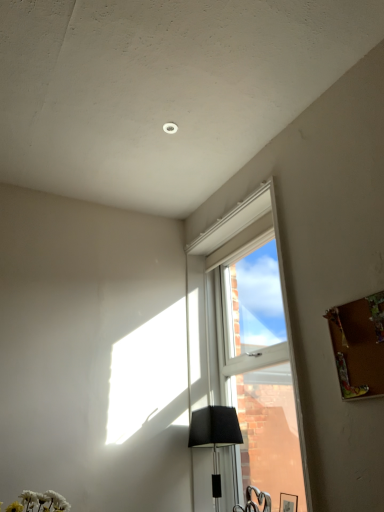
Question: Is matte black lampshade at lower center positioned behind clear glass window at center?

Choices:
 (A) no
 (B) yes

Answer: (B)

Question: From the image's perspective, does matte black lampshade at lower center appear higher than clear glass window at center?

Choices:
 (A) no
 (B) yes

Answer: (A)

Question: Does matte black lampshade at lower center appear on the right side of clear glass window at center?

Choices:
 (A) no
 (B) yes

Answer: (A)

Question: Does matte black lampshade at lower center have a greater height compared to clear glass window at center?

Choices:
 (A) yes
 (B) no

Answer: (B)

Question: Is matte black lampshade at lower center outside of clear glass window at center?

Choices:
 (A) no
 (B) yes

Answer: (B)

Question: Is matte black lampshade at lower center looking in the opposite direction of clear glass window at center?

Choices:
 (A) no
 (B) yes

Answer: (B)

Question: Are clear glass window at center and matte black lampshade at lower center far apart?

Choices:
 (A) yes
 (B) no

Answer: (B)

Question: Does clear glass window at center have a smaller size compared to matte black lampshade at lower center?

Choices:
 (A) yes
 (B) no

Answer: (B)

Question: Is clear glass window at center next to matte black lampshade at lower center and touching it?

Choices:
 (A) no
 (B) yes

Answer: (A)

Question: Considering the relative sizes of clear glass window at center and matte black lampshade at lower center in the image provided, is clear glass window at center bigger than matte black lampshade at lower center?

Choices:
 (A) yes
 (B) no

Answer: (A)

Question: Considering the relative sizes of clear glass window at center and matte black lampshade at lower center in the image provided, is clear glass window at center wider than matte black lampshade at lower center?

Choices:
 (A) yes
 (B) no

Answer: (B)

Question: Is clear glass window at center surrounding matte black lampshade at lower center?

Choices:
 (A) no
 (B) yes

Answer: (A)

Question: Visually, is clear glass window at center positioned to the left or to the right of matte black lampshade at lower center?

Choices:
 (A) left
 (B) right

Answer: (B)